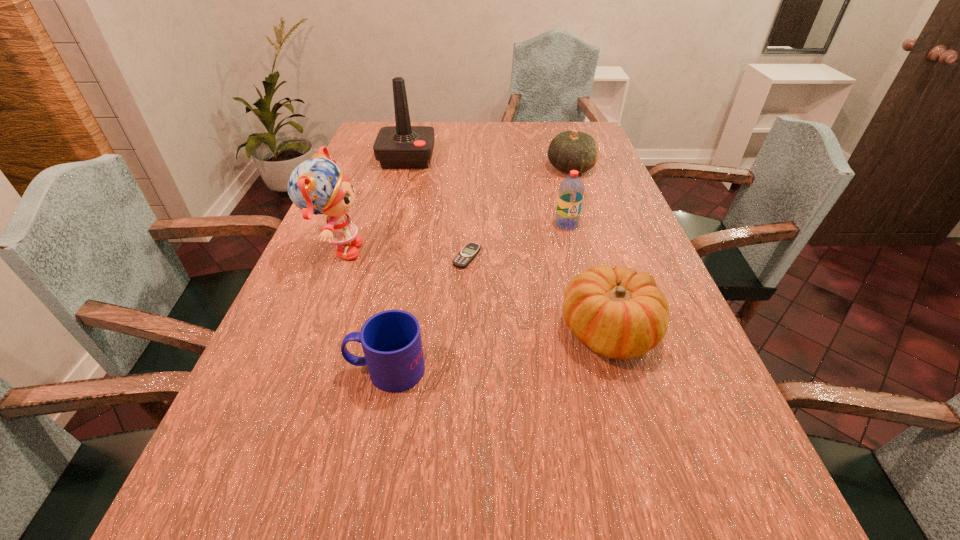
I want to click on free spot between the nearer gourd and the sixth tallest object, so click(498, 351).

Find the location of a particular element. free space between the mug and the joystick is located at coordinates (396, 264).

You are a GUI agent. You are given a task and a screenshot of the screen. Output one action in this format:
    pyautogui.click(x=<x>, y=<y>)
    Task: Click on the free space between the farther gourd and the mug
    The width and height of the screenshot is (960, 540).
    Given the screenshot: What is the action you would take?
    pyautogui.click(x=479, y=269)

Identify the location of free space that is in between the fourth object from right to left and the second shortest object. (427, 313).

Locate an element on the screen. This screenshot has width=960, height=540. object that stands as the fourth closest to the fourth object from left to right is located at coordinates (391, 341).

Identify the location of the sixth closest object to the beeper. The image size is (960, 540). (403, 146).

Locate an element on the screen. free space that satisfies the following two spatial constraints: 1. on the back side of the shortest object; 2. on the face of the doll is located at coordinates [x=468, y=252].